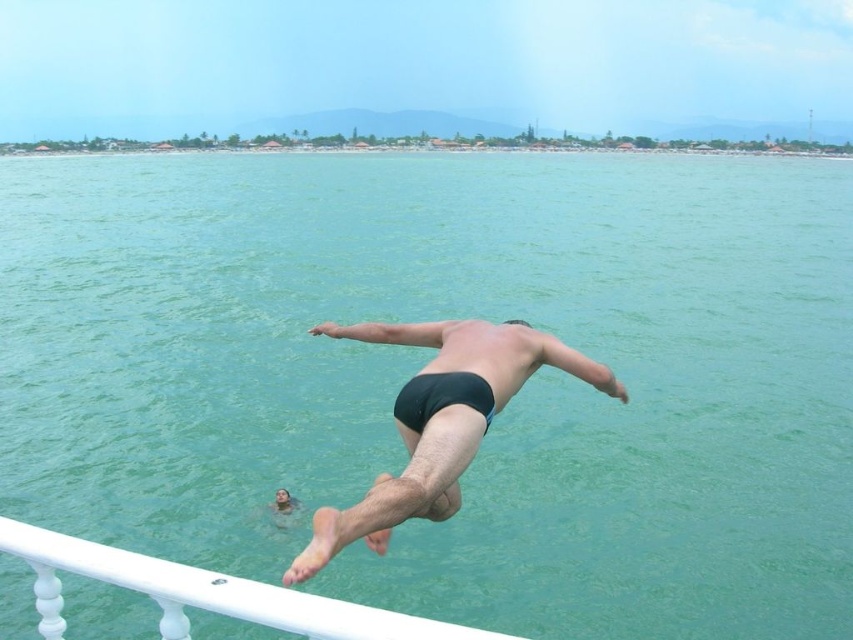
Between white glossy rail at lower left and black matte swim trunks at lower center, which one has less height?

Standing shorter between the two is black matte swim trunks at lower center.

Does point (215, 589) come closer to viewer compared to point (279, 509)?

Yes, it is in front of point (279, 509).

You are a GUI agent. You are given a task and a screenshot of the screen. Output one action in this format:
    pyautogui.click(x=<x>, y=<y>)
    Task: Click on the white glossy rail at lower left
    The image size is (853, 640).
    Given the screenshot: What is the action you would take?
    pyautogui.click(x=206, y=593)

Between point (590, 360) and point (68, 570), which one is positioned behind?

Point (590, 360)

Can you confirm if black matte swim trunks at center is smaller than white glossy rail at lower left?

No.

Is point (474, 365) farther from viewer compared to point (294, 632)?

Yes, it is.

Where is `black matte swim trunks at center`? black matte swim trunks at center is located at coordinates (399, 488).

Does black matte swim trunks at center have a greater height compared to black matte swim trunks at lower center?

Yes.

Can you confirm if black matte swim trunks at center is shorter than black matte swim trunks at lower center?

No.

The height and width of the screenshot is (640, 853). Identify the location of black matte swim trunks at center. (399, 488).